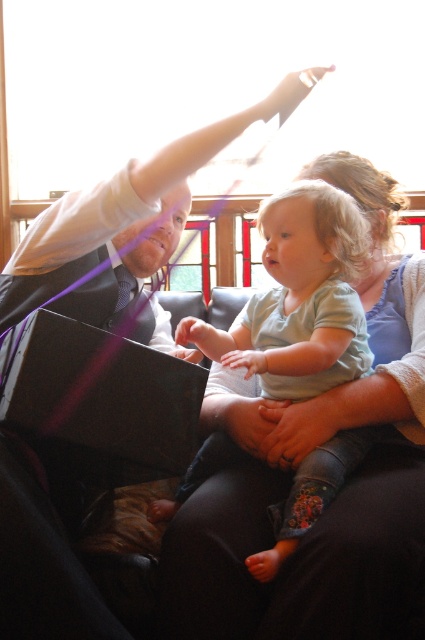
You are organizing a small event and need to place the matte black suit at upper left and the matte black laptop at lower left on a shelf. The shelf has limited space. Based on their sizes, which object should you place first to ensure both fit?

The matte black suit at upper left is larger in size than the matte black laptop at lower left. Therefore, you should place the matte black suit at upper left first to accommodate its larger size, ensuring there is enough space left for the smaller matte black laptop at lower left.

You are a photographer setting up a shoot in the living room. You need to ensure that both the light green cotton shirt at center and the matte black laptop at lower left are visible in the frame. Based on their positions, will the laptop be partially or fully visible when focusing on the shirt?

The matte black laptop at lower left is behind the light green cotton shirt at center, so when focusing on the shirt, the laptop will be partially visible behind it.

You are an interior designer assessing the living room layout. You notice the matte black suit at upper left and the matte black laptop at lower left. Which object occupies a larger vertical space in the room?

The matte black suit at upper left has a greater height compared to the matte black laptop at lower left, so it occupies a larger vertical space in the room.